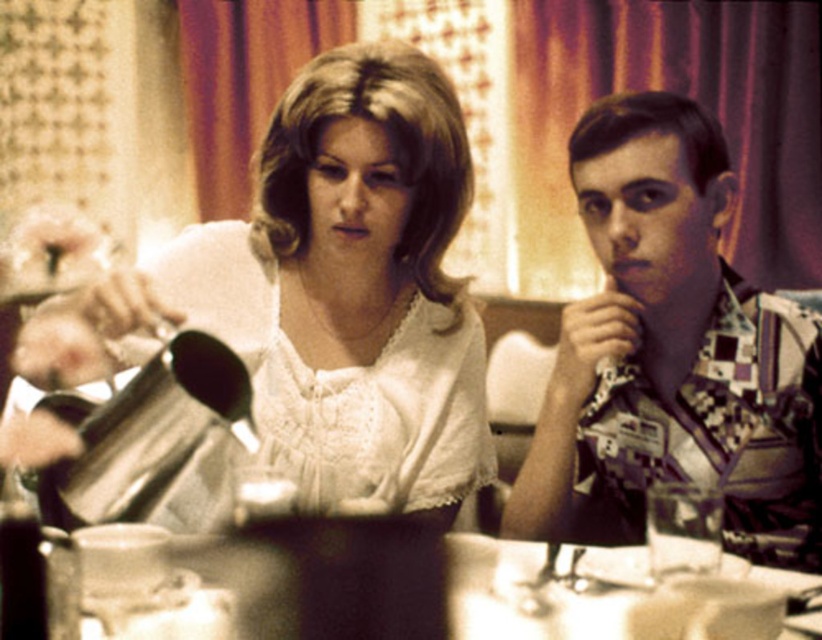
You are standing in front of the scene and want to reach the point at coordinates point (x=784, y=493). Can you comfortably reach it without moving your feet?

The point (x=784, y=493) is 1.15 meters from the viewer, so yes, you can comfortably reach it without moving your feet since it is within arm reach.